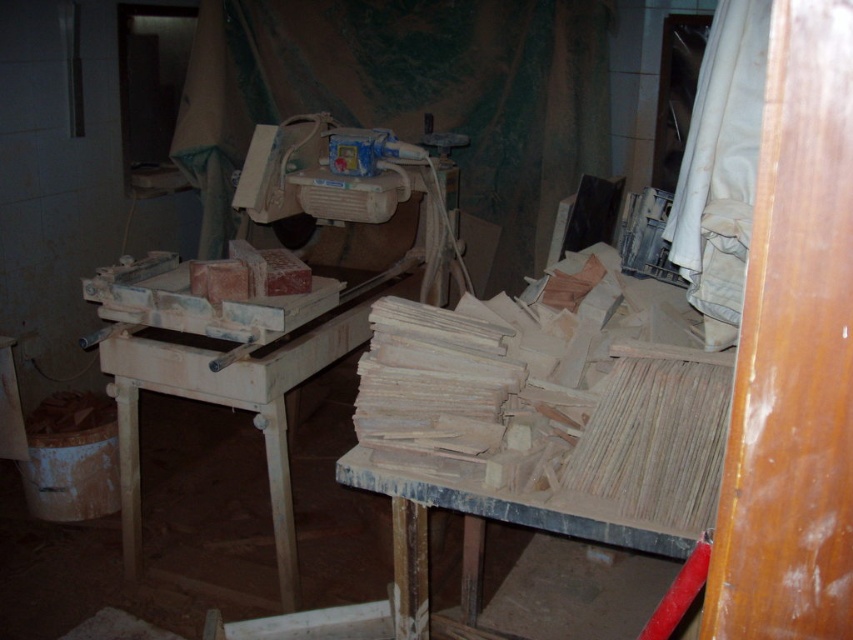
Does wooden table at center come behind wooden at center?

Yes, it is behind wooden at center.

Is wooden table at center to the right of wooden at center from the viewer's perspective?

In fact, wooden table at center is to the left of wooden at center.

You are a GUI agent. You are given a task and a screenshot of the screen. Output one action in this format:
    pyautogui.click(x=<x>, y=<y>)
    Task: Click on the wooden table at center
    This screenshot has width=853, height=640.
    Given the screenshot: What is the action you would take?
    pyautogui.click(x=221, y=365)

At what (x,y) coordinates should I click in order to perform the action: click on wooden table at center. Please return your answer as a coordinate pair (x, y). Looking at the image, I should click on (221, 365).